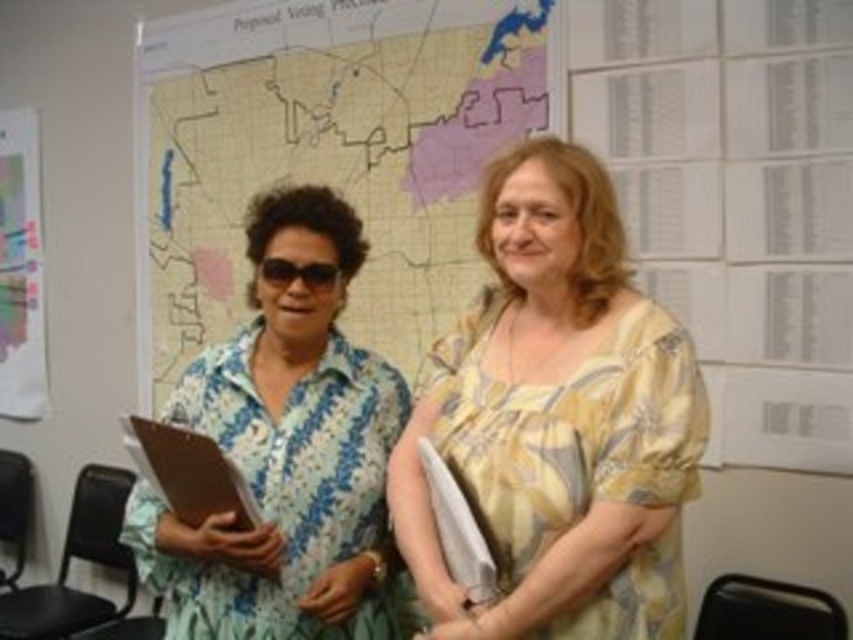
You are a photographer positioned at the camera. You want to take a photo of both the point at [393,273] and the point at [590,580] in the image. Which point is closer to your camera?

The point at [393,273] is further to the camera than the point at [590,580], so the point at [590,580] is closer to your camera.

You are standing in the meeting room and need to locate the floral fabric blouse at left. According to the coordinates provided, where exactly is it positioned?

The floral fabric blouse at left is positioned at point (286, 456).